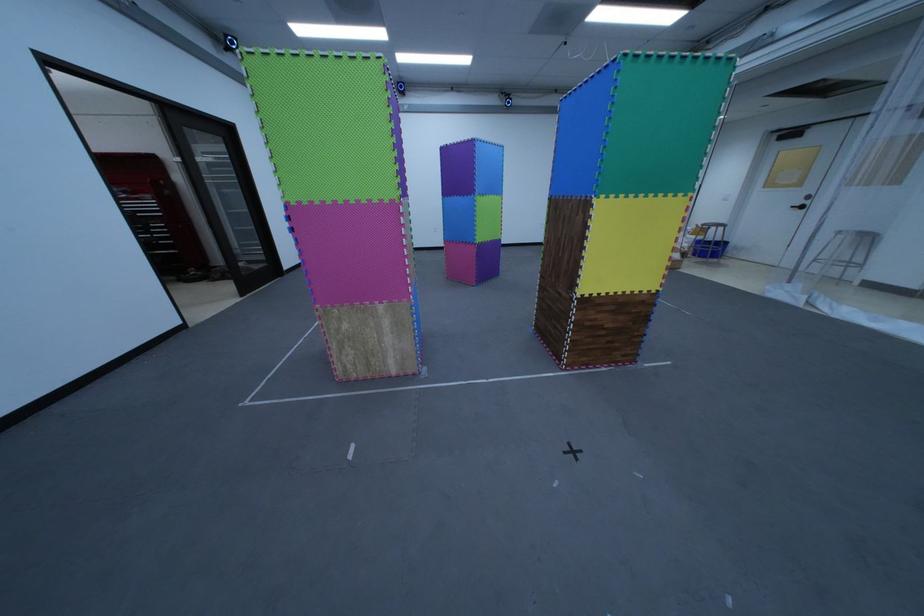
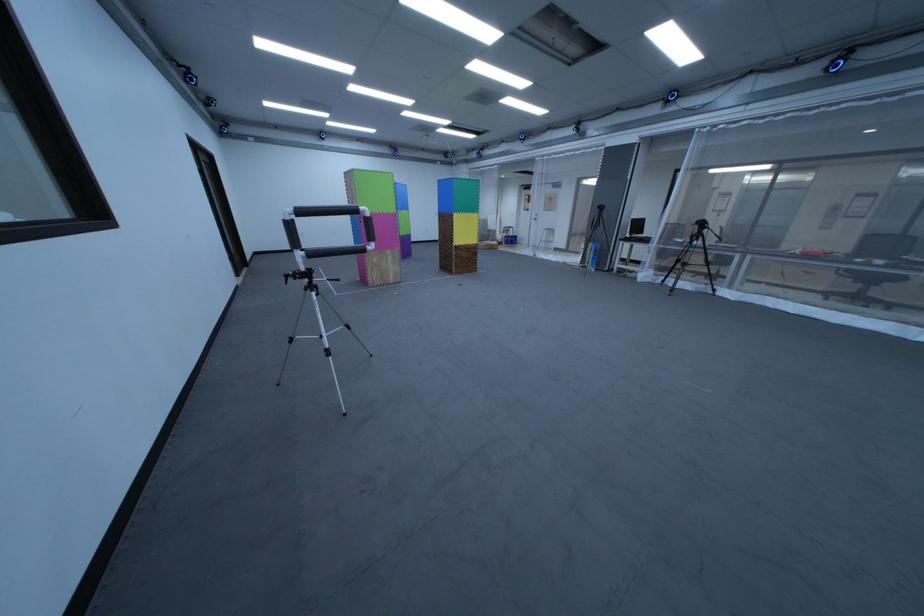
In the second image, find the point that corresponds to point (702, 246) in the first image.

(517, 238)